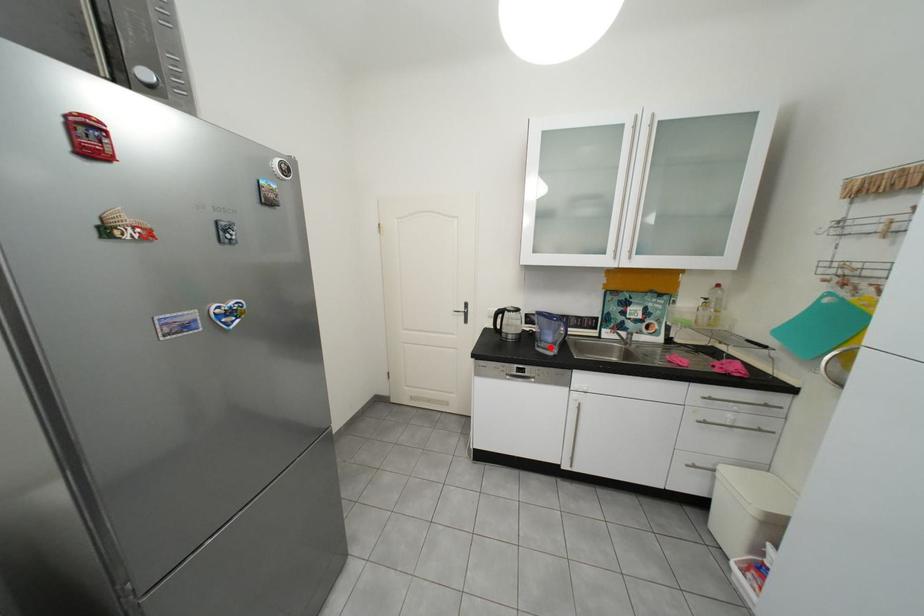
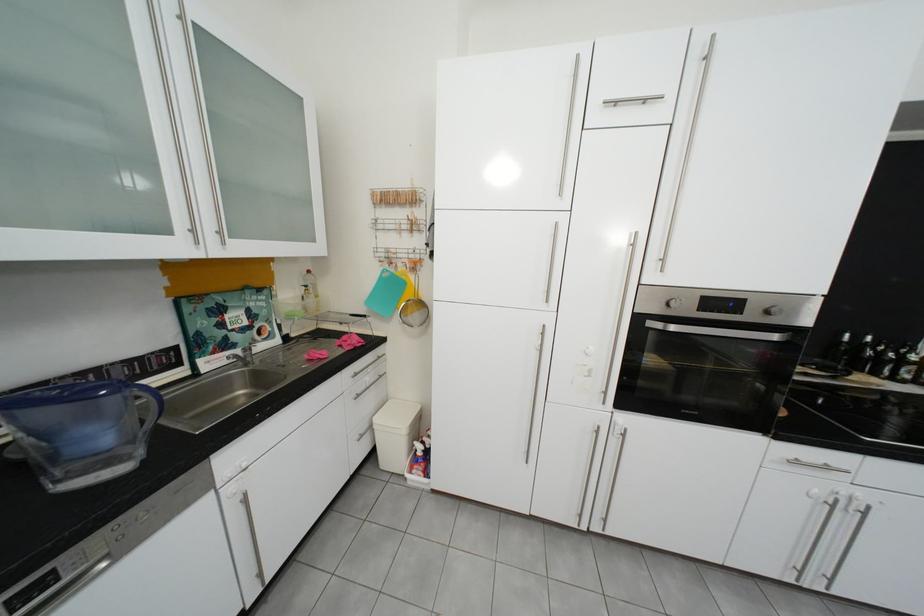
Where in the second image is the point corresponding to the highlighted location from the first image?

(70, 483)